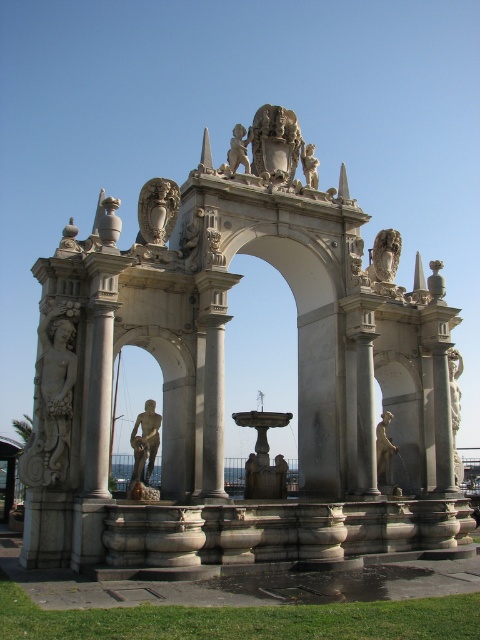
Question: Which of these objects is positioned closest to the white marble statue at right?

Choices:
 (A) white marble statue at center
 (B) carved stone figure at left

Answer: (B)

Question: Which object appears farthest from the camera in this image?

Choices:
 (A) matte bronze statue at center
 (B) white marble statue at right
 (C) white marble column at center

Answer: (B)

Question: In this image, where is white marble column at center located relative to polished bronze cherub at center top?

Choices:
 (A) below
 (B) above

Answer: (A)

Question: Considering the relative positions of white marble arch at center and matte bronze statue at center in the image provided, where is white marble arch at center located with respect to matte bronze statue at center?

Choices:
 (A) below
 (B) above

Answer: (B)

Question: Which object is closer to the camera taking this photo?

Choices:
 (A) white marble statue at upper center
 (B) white marble statue at center
 (C) polished stone fountain at center

Answer: (C)

Question: Can you confirm if white marble column at center is thinner than matte bronze statue at center?

Choices:
 (A) yes
 (B) no

Answer: (B)